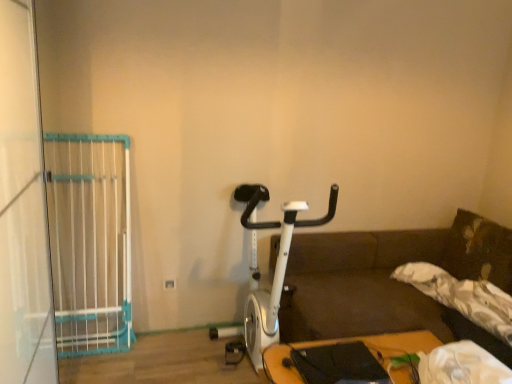
Question: Is white plastic gate at left wider or thinner than white metallic stationary bicycle at center?

Choices:
 (A) thin
 (B) wide

Answer: (A)

Question: From the image's perspective, is white plastic gate at left positioned above or below white metallic stationary bicycle at center?

Choices:
 (A) above
 (B) below

Answer: (A)

Question: Considering the real-world distances, which object is closest to the white plastic gate at left?

Choices:
 (A) wooden table at lower right
 (B) white plastic gate at left
 (C) white metallic stationary bicycle at center

Answer: (B)

Question: Estimate the real-world distances between objects in this image. Which object is farther from the white metallic stationary bicycle at center?

Choices:
 (A) wooden table at lower right
 (B) white plastic gate at left
 (C) white plastic gate at left

Answer: (C)